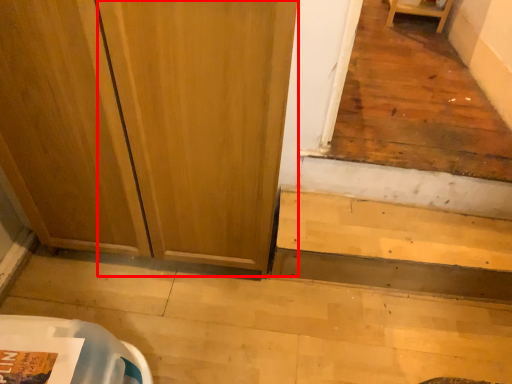
Question: From the image's perspective, considering the relative positions of screen door (annotated by the red box) and stairwell in the image provided, where is screen door (annotated by the red box) located with respect to the staircase?

Choices:
 (A) above
 (B) below

Answer: (A)